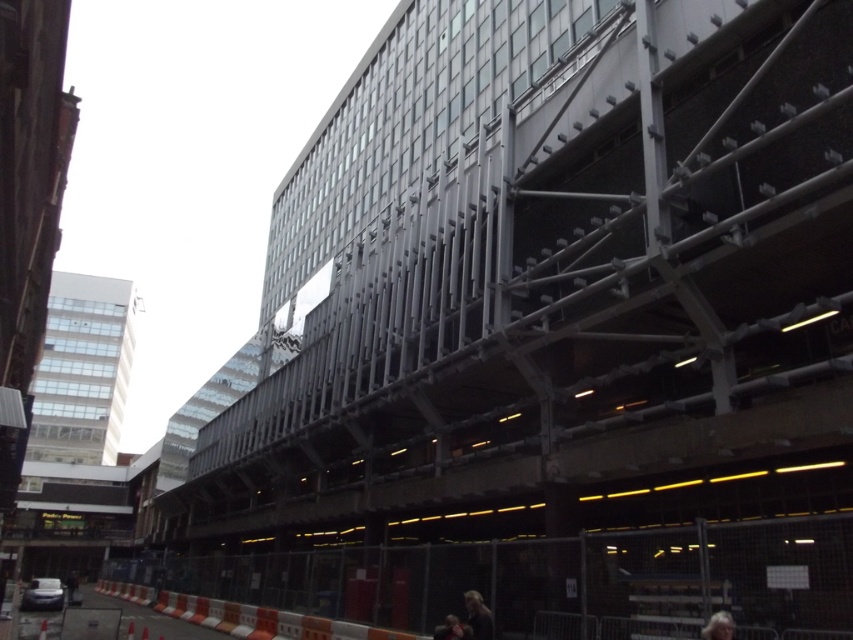
Between light brown hair at lower center and dark hair at lower center, which one has more height?

Standing taller between the two is dark hair at lower center.

How far apart are light brown hair at lower center and dark hair at lower center?

The distance of light brown hair at lower center from dark hair at lower center is 10.49 inches.

Between point (465, 604) and point (463, 628), which one is positioned behind?

The point (465, 604) is more distant.

This screenshot has height=640, width=853. In order to click on light brown hair at lower center in this screenshot , I will do `click(479, 616)`.

Is light brown hair at lower center further to camera compared to gray hair at lower right?

Yes, light brown hair at lower center is behind gray hair at lower right.

The image size is (853, 640). Find the location of `light brown hair at lower center`. light brown hair at lower center is located at coordinates (479, 616).

Identify the location of light brown hair at lower center. This screenshot has width=853, height=640. (479, 616).

Who is taller, orange and white striped barrier at lower center or light brown hair at lower center?

Standing taller between the two is orange and white striped barrier at lower center.

Between orange and white striped barrier at lower center and light brown hair at lower center, which one is positioned lower?

orange and white striped barrier at lower center is lower down.

Measure the distance between orange and white striped barrier at lower center and camera.

A distance of 41.73 feet exists between orange and white striped barrier at lower center and camera.

Identify the location of orange and white striped barrier at lower center. This screenshot has width=853, height=640. (244, 616).